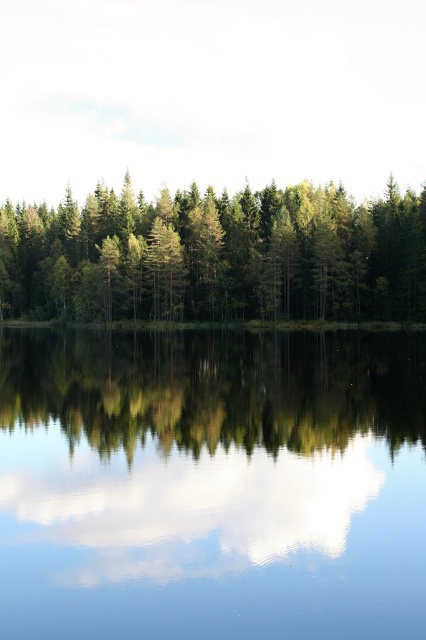
You are standing at the edge of the water and see the transparent glass water at center and the green matte tree at center. Which object is located to the right of the other?

The transparent glass water at center is positioned on the right side of green matte tree at center.

You are standing at the point closest to the camera in the image. Which of the two points, point (353, 337) or point (184, 241), are you currently at?

You are at point (353, 337) because it is closer to the camera than point (184, 241).

You are an artist trying to paint the landscape. You notice the transparent glass water at center and the green matte tree at center. Which object should you paint first if you want to follow the rule of painting smaller objects before larger ones?

The transparent glass water at center should be painted first because it occupies less space than the green matte tree at center, making it smaller in size.